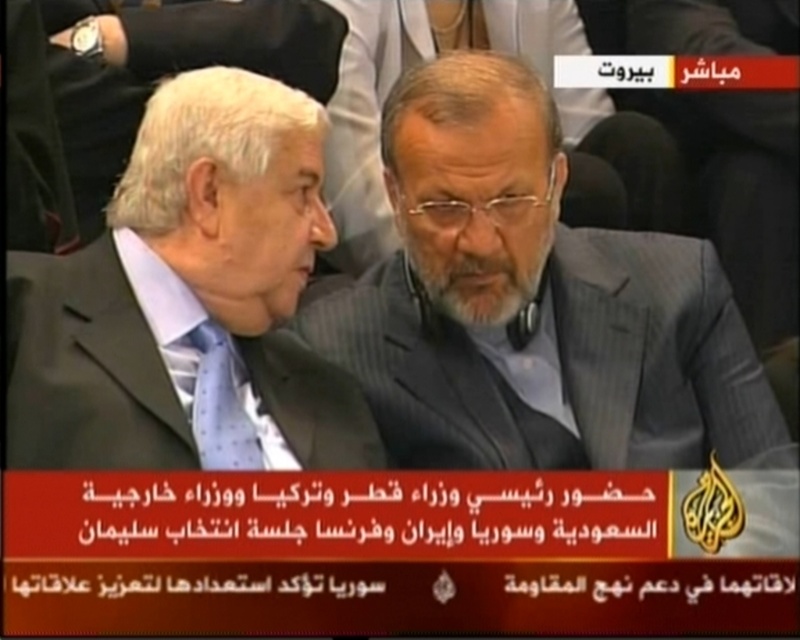
Question: Does gray textured suit at center have a larger size compared to matte black suit at center?

Choices:
 (A) yes
 (B) no

Answer: (A)

Question: Which object appears closest to the camera in this image?

Choices:
 (A) gray textured suit at center
 (B) matte black suit at center

Answer: (B)

Question: Does gray textured suit at center lie in front of matte black suit at center?

Choices:
 (A) no
 (B) yes

Answer: (A)

Question: Can you confirm if gray textured suit at center is thinner than matte black suit at center?

Choices:
 (A) no
 (B) yes

Answer: (A)